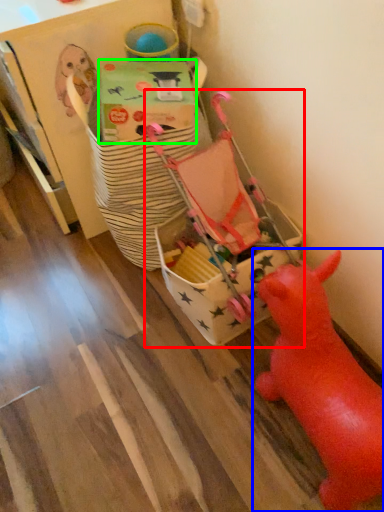
Question: Which object is positioned farthest from toy (highlighted by a red box)? Select from toy (highlighted by a blue box) and cardboard box (highlighted by a green box).

Choices:
 (A) toy
 (B) cardboard box

Answer: (A)